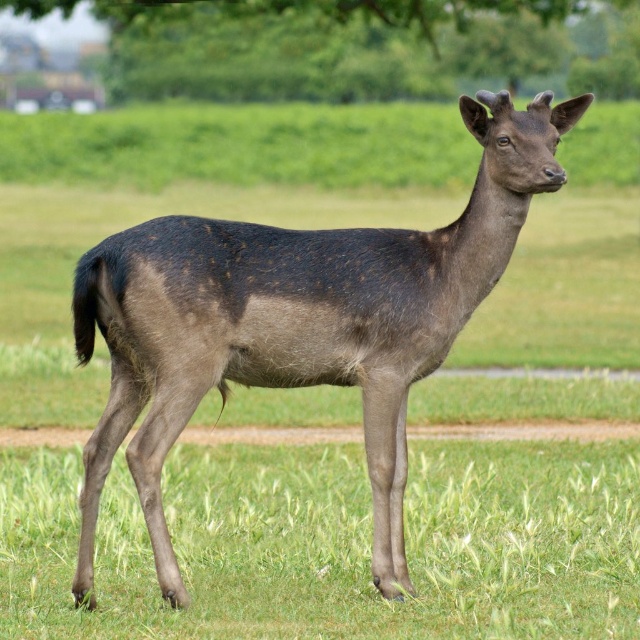
Question: Is brown fur deer at center above green leafy tree at upper center?

Choices:
 (A) yes
 (B) no

Answer: (B)

Question: Is brown fur deer at center closer to the viewer compared to green leafy tree at upper center?

Choices:
 (A) yes
 (B) no

Answer: (A)

Question: Does brown fur deer at center appear over green leafy tree at upper center?

Choices:
 (A) yes
 (B) no

Answer: (B)